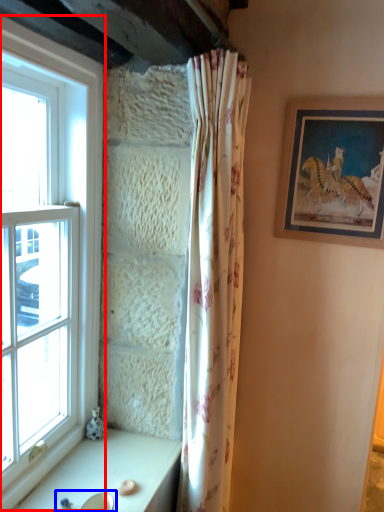
Question: Among these objects, which one is farthest to the camera, window (highlighted by a red box) or sink (highlighted by a blue box)?

Choices:
 (A) window
 (B) sink

Answer: (B)